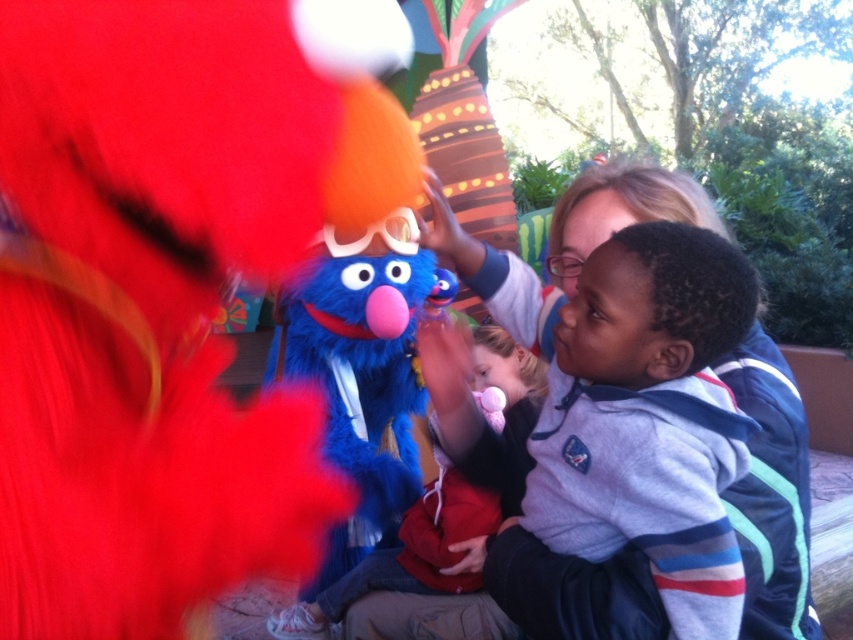
You are a photographer trying to capture a photo of the fuzzy blue puppet at center and the fluffy blue costume at center. Which one should you focus on first if you want to take a picture from left to right?

The fuzzy blue puppet at center should be focused on first since it is positioned to the left of the fluffy blue costume at center when taking a photo from left to right.

What object is located at the coordinates point (631, 476) in the image?

The point (631, 476) corresponds to smooth blond hair at upper center.